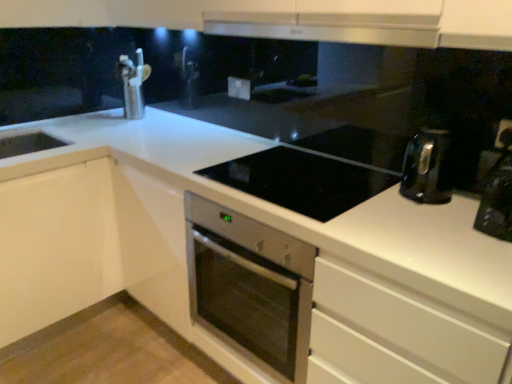
Question: From the image's perspective, is stainless steel oven at center beneath brushed metal faucet at upper left?

Choices:
 (A) yes
 (B) no

Answer: (A)

Question: Is stainless steel oven at center looking in the opposite direction of brushed metal faucet at upper left?

Choices:
 (A) no
 (B) yes

Answer: (A)

Question: Is stainless steel oven at center to the left of brushed metal faucet at upper left from the viewer's perspective?

Choices:
 (A) no
 (B) yes

Answer: (A)

Question: Can you confirm if stainless steel oven at center is wider than brushed metal faucet at upper left?

Choices:
 (A) yes
 (B) no

Answer: (A)

Question: Considering the relative sizes of stainless steel oven at center and brushed metal faucet at upper left in the image provided, is stainless steel oven at center thinner than brushed metal faucet at upper left?

Choices:
 (A) yes
 (B) no

Answer: (B)

Question: Is black glossy coffee machine at right to the left or to the right of stainless steel oven at center in the image?

Choices:
 (A) right
 (B) left

Answer: (A)

Question: Is black glossy coffee machine at right bigger or smaller than stainless steel oven at center?

Choices:
 (A) big
 (B) small

Answer: (B)

Question: From their relative heights in the image, would you say black glossy coffee machine at right is taller or shorter than stainless steel oven at center?

Choices:
 (A) tall
 (B) short

Answer: (B)

Question: Considering their positions, is black glossy coffee machine at right located in front of or behind stainless steel oven at center?

Choices:
 (A) front
 (B) behind

Answer: (A)

Question: In terms of height, does brushed metal faucet at upper left look taller or shorter compared to satin silver exhaust hood at upper center?

Choices:
 (A) short
 (B) tall

Answer: (B)

Question: Is brushed metal faucet at upper left bigger or smaller than satin silver exhaust hood at upper center?

Choices:
 (A) small
 (B) big

Answer: (A)

Question: Does point (132, 100) appear closer or farther from the camera than point (207, 16)?

Choices:
 (A) farther
 (B) closer

Answer: (A)

Question: Considering their positions, is brushed metal faucet at upper left located in front of or behind satin silver exhaust hood at upper center?

Choices:
 (A) behind
 (B) front

Answer: (A)

Question: Do you think brushed metal faucet at upper left is within white plastic electric outlet at upper center, the 2th electric outlet when ordered from back to front, or outside of it?

Choices:
 (A) outside
 (B) inside

Answer: (A)

Question: Is point (138, 114) positioned closer to the camera than point (500, 127)?

Choices:
 (A) closer
 (B) farther

Answer: (B)